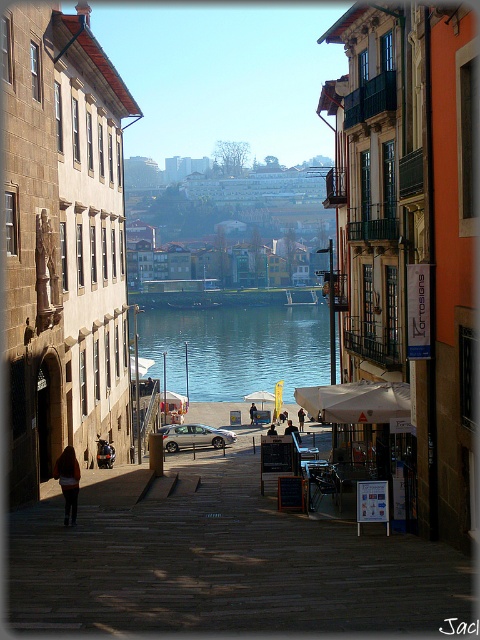
Based on the photo, you are standing on the cobblestone street in the scene and want to take a photo of the blue glassy water at center without any obstructions. Is the dark brown leather jacket at lower left blocking your view?

The dark brown leather jacket at lower left is behind the blue glassy water at center, so it won not block your view.